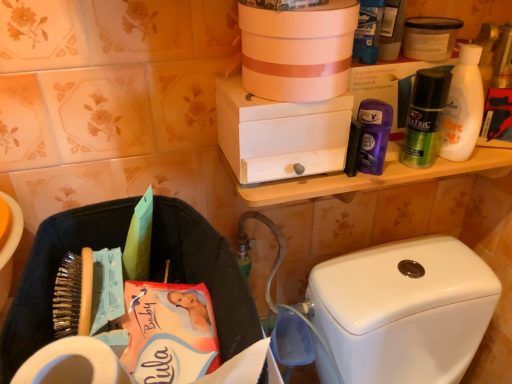
Question: From a real-world perspective, relative to white glossy toilet tank at lower right, is white matte box at upper center, acting as the 1th box starting from the bottom, vertically above or below?

Choices:
 (A) above
 (B) below

Answer: (A)

Question: In terms of width, does white matte box at upper center, the second box viewed from the top, look wider or thinner when compared to white glossy toilet tank at lower right?

Choices:
 (A) thin
 (B) wide

Answer: (A)

Question: Estimate the real-world distances between objects in this image. Which object is farther from the white matte container at upper right?

Choices:
 (A) purple glossy deodorant at upper right, the 2th toiletry when ordered from right to left
 (B) white matte bottle at upper right
 (C) matte white bucket at upper center, the 1th box when ordered from top to bottom
 (D) black fabric laundry basket at lower left
 (E) white matte box at upper center, acting as the 1th box starting from the bottom

Answer: (D)

Question: Estimate the real-world distances between objects in this image. Which object is farther from the white matte toilet paper at lower left?

Choices:
 (A) green matte deodorant at upper right, the 2th toiletry when ordered from left to right
 (B) matte white bucket at upper center, the 2th box from the bottom
 (C) white matte bottle at upper right
 (D) purple glossy deodorant at upper right, arranged as the first toiletry when viewed from the left
 (E) white matte box at upper center, the second box viewed from the top

Answer: (C)